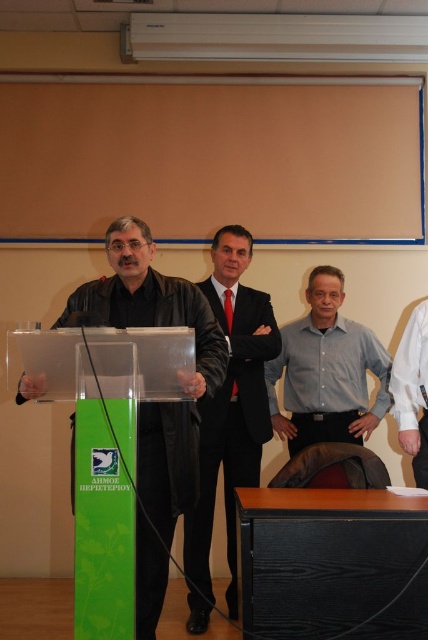
You are a photographer setting up for a group photo in the conference room. You need to position the black suit at center and the light blue shirt at center so that they are exactly 24 inches apart. Can you adjust their current position to achieve this?

The current distance between the black suit at center and the light blue shirt at center is 17.07 inches. To reach the required 24 inches, you need to increase the distance between them by 6.93 inches.

You are standing in the conference room and need to locate the green wood podium at center. According to the coordinates provided, where should you look to find it?

The green wood podium at center is located at point coordinates 0.872 on the x axis and 0.757 on the y axis.

You are a photographer positioned behind the podium in the conference room. You need to capture a photo of both the black leather jacket at center and the light blue shirt at center. Which clothing item will appear wider in the photo?

The black leather jacket at center will appear wider in the photo because its width surpasses that of the light blue shirt at center.